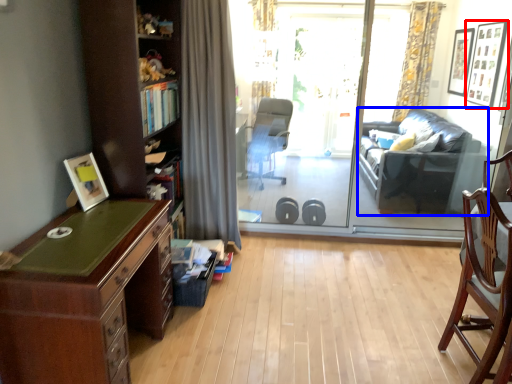
Question: Which of the following is the closest to the observer, picture frame (highlighted by a red box) or studio couch (highlighted by a blue box)?

Choices:
 (A) picture frame
 (B) studio couch

Answer: (B)